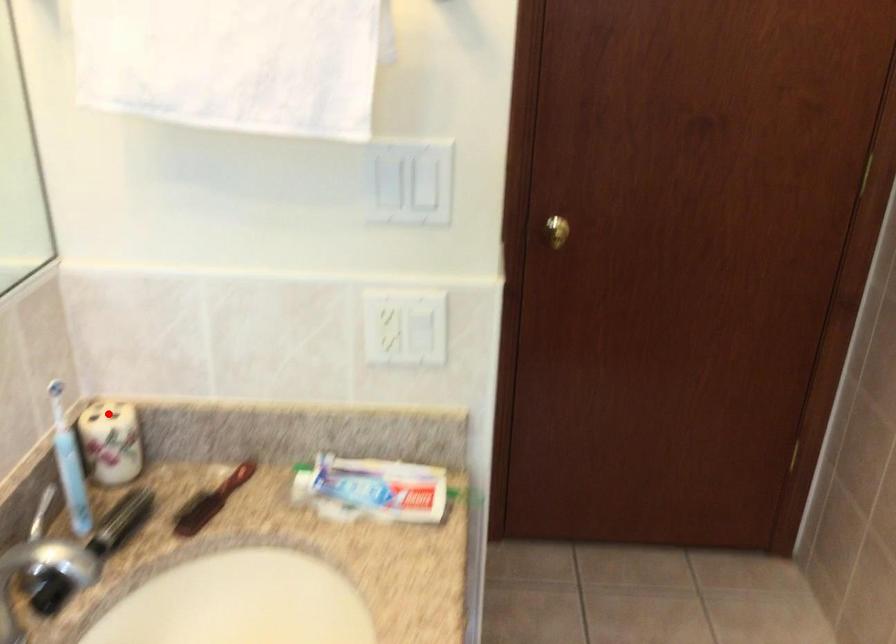
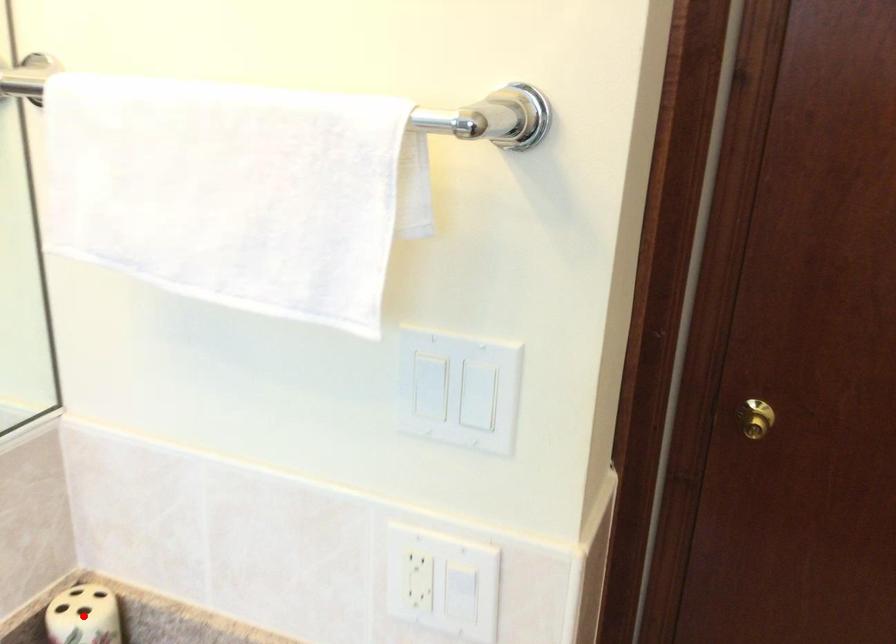
I am providing you with two images of the same scene from different viewpoints. A red point is marked on the first image and another point is marked on the second image. Do the highlighted points in image1 and image2 indicate the same real-world spot?

Yes